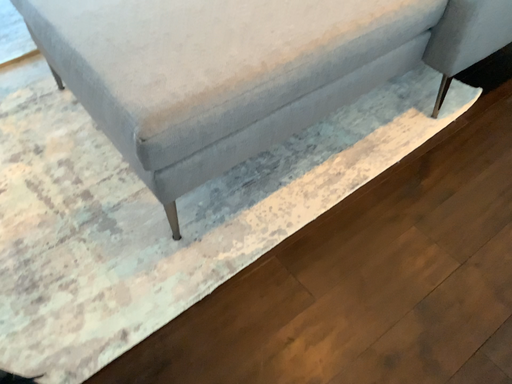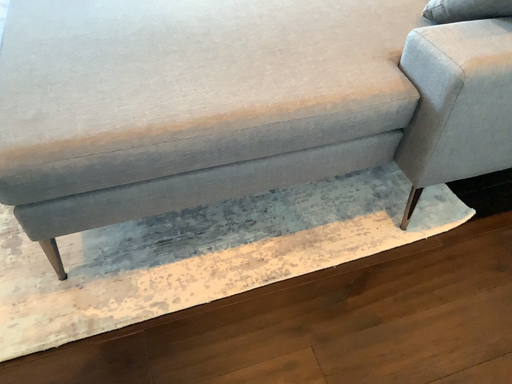
Question: Which way did the camera rotate in the video?

Choices:
 (A) rotated upward
 (B) rotated downward

Answer: (A)